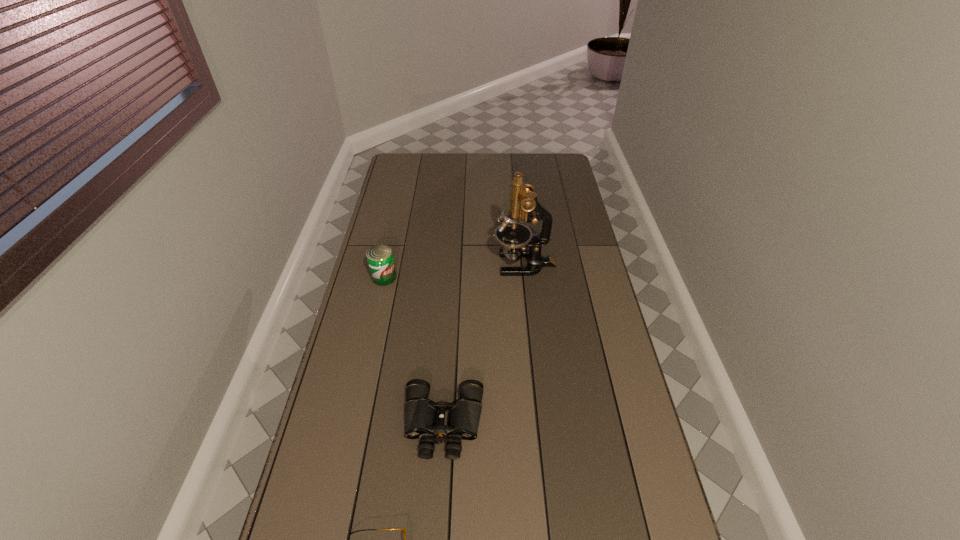
Identify the location of free space that satisfies the following two spatial constraints: 1. at the eyepiece of the microscope; 2. through the eyepieces of the second shortest object. (541, 424).